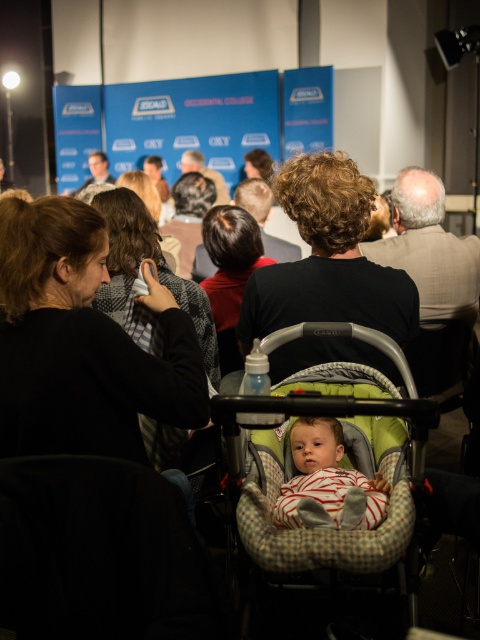
Question: Does plaid fabric baby carriage at center appear on the left side of striped fabric baby at center?

Choices:
 (A) no
 (B) yes

Answer: (A)

Question: Is plaid fabric baby carriage at center thinner than striped fabric baby at center?

Choices:
 (A) no
 (B) yes

Answer: (A)

Question: Can you confirm if plaid fabric baby carriage at center is bigger than striped fabric baby at center?

Choices:
 (A) yes
 (B) no

Answer: (A)

Question: Which object appears closest to the camera in this image?

Choices:
 (A) plaid fabric baby carriage at center
 (B) striped fabric baby at center

Answer: (A)

Question: Which of the following is the closest to the observer?

Choices:
 (A) (313, 456)
 (B) (266, 353)

Answer: (B)

Question: Which point appears closest to the camera in this image?

Choices:
 (A) (263, 396)
 (B) (355, 477)

Answer: (A)